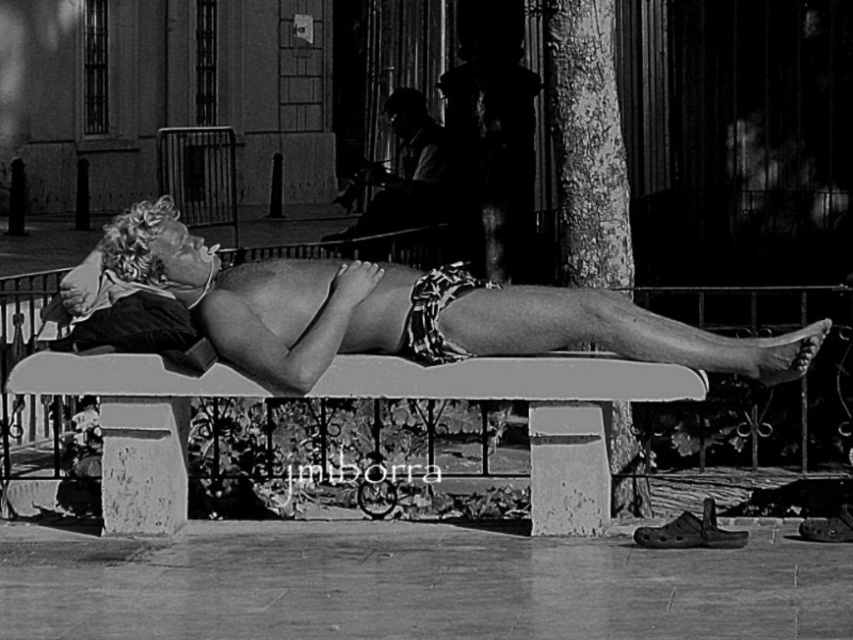
Question: Can you confirm if printed fabric bikini at center is bigger than smooth leather jacket at upper center?

Choices:
 (A) no
 (B) yes

Answer: (B)

Question: Does printed fabric bikini at center appear on the left side of smooth concrete bench at center?

Choices:
 (A) no
 (B) yes

Answer: (A)

Question: Among these objects, which one is farthest from the camera?

Choices:
 (A) printed fabric shorts at center
 (B) printed fabric bikini at center
 (C) smooth concrete bench at center

Answer: (A)

Question: Which point appears farthest from the camera in this image?

Choices:
 (A) (442, 353)
 (B) (433, 349)
 (C) (440, 220)
 (D) (103, 497)

Answer: (C)

Question: Which of the following is the farthest from the observer?

Choices:
 (A) (573, 477)
 (B) (422, 316)
 (C) (440, 195)

Answer: (C)

Question: Is smooth leather jacket at upper center thinner than printed fabric shorts at center?

Choices:
 (A) yes
 (B) no

Answer: (A)